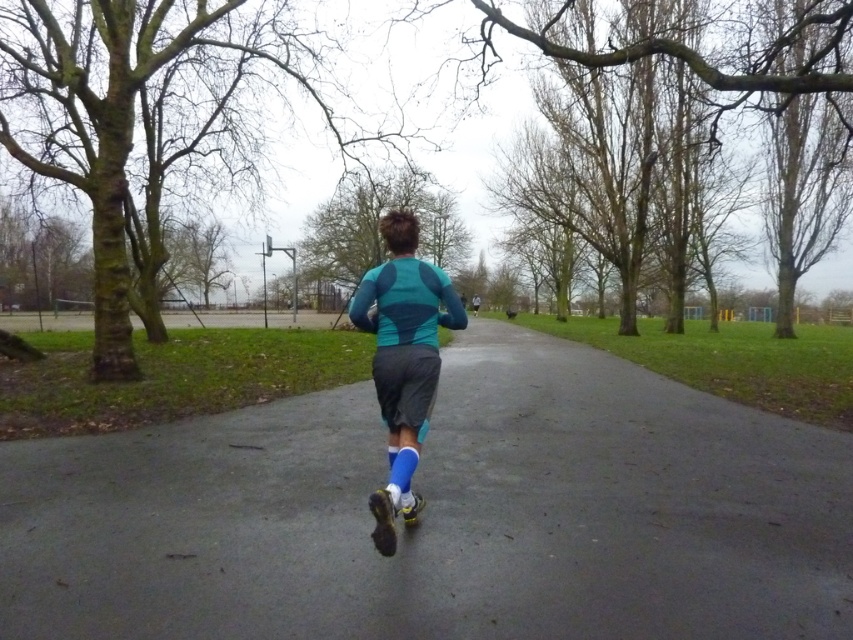
The height and width of the screenshot is (640, 853). What do you see at coordinates (440, 515) in the screenshot?
I see `smooth asphalt path at center` at bounding box center [440, 515].

Locate an element on the screen. Image resolution: width=853 pixels, height=640 pixels. smooth asphalt path at center is located at coordinates (440, 515).